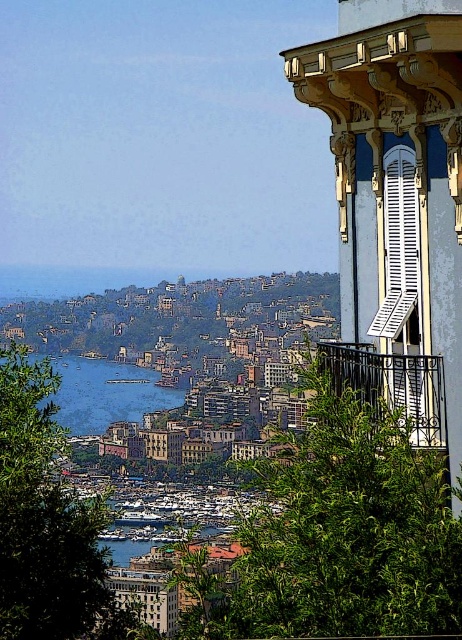
Who is more distant from viewer, (415, 435) or (394, 230)?

Point (394, 230)

Find the location of a particular element. The width and height of the screenshot is (462, 640). black wrought iron balcony at upper right is located at coordinates (391, 385).

Is green leafy tree at lower left bigger than blue water at center?

No, green leafy tree at lower left is not bigger than blue water at center.

Does green leafy tree at lower left appear on the left side of blue water at center?

Incorrect, green leafy tree at lower left is not on the left side of blue water at center.

At what (x,y) coordinates should I click in order to perform the action: click on green leafy tree at lower left. Please return your answer as a coordinate pair (x, y). Looking at the image, I should click on (46, 522).

Can you confirm if green leafy tree at lower left is smaller than white matte shutter at upper right?

No.

Is green leafy tree at lower left bigger than white matte shutter at upper right?

Yes, green leafy tree at lower left is bigger than white matte shutter at upper right.

Is point (44, 483) farther from viewer compared to point (396, 168)?

Yes.

This screenshot has width=462, height=640. Identify the location of green leafy tree at lower left. tap(46, 522).